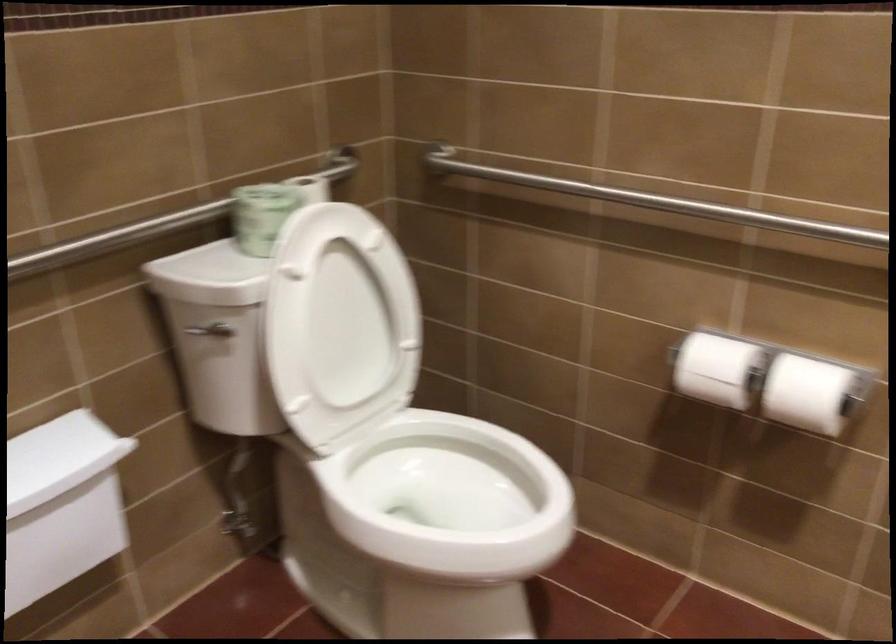
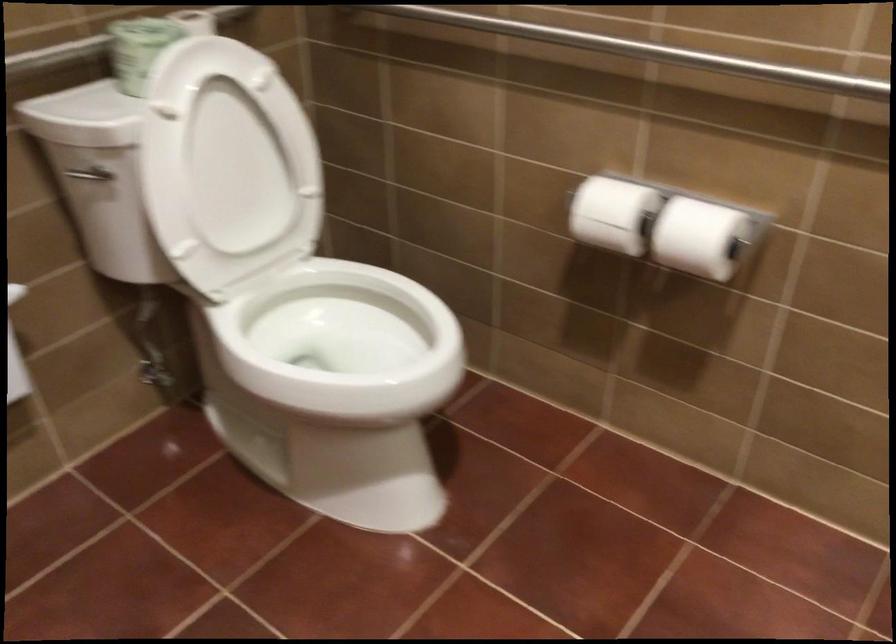
Question: The images are taken continuously from a first-person perspective. In which direction is your viewpoint rotating?

Choices:
 (A) Left
 (B) Right
 (C) Up
 (D) Down

Answer: (D)